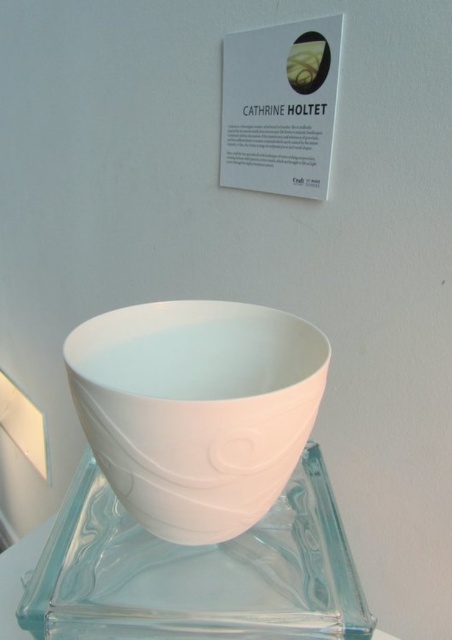
Who is more distant from viewer, (146, 344) or (85, 582)?

The point (146, 344) is behind.

Is white matte bowl at center taller than transparent glass plate at center?

Correct, white matte bowl at center is much taller as transparent glass plate at center.

Locate an element on the screen. Image resolution: width=452 pixels, height=640 pixels. white matte bowl at center is located at coordinates (197, 410).